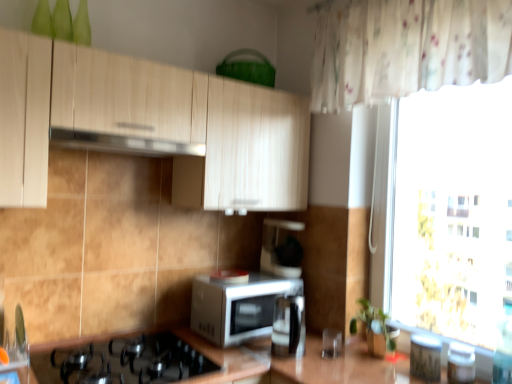
Question: Is white sheer curtain at right to the left of metallic silver toaster at lower right, which is the 2th appliance from right to left, from the viewer's perspective?

Choices:
 (A) yes
 (B) no

Answer: (B)

Question: Can you confirm if white sheer curtain at right is wider than metallic silver toaster at lower right, which is the 2th appliance from right to left?

Choices:
 (A) no
 (B) yes

Answer: (A)

Question: Is white sheer curtain at right further to the viewer compared to metallic silver toaster at lower right, which appears as the second appliance when viewed from the left?

Choices:
 (A) yes
 (B) no

Answer: (B)

Question: Considering the relative positions of white sheer curtain at right and metallic silver toaster at lower right, which appears as the second appliance when viewed from the left, in the image provided, is white sheer curtain at right to the right of metallic silver toaster at lower right, which appears as the second appliance when viewed from the left, from the viewer's perspective?

Choices:
 (A) no
 (B) yes

Answer: (B)

Question: Is white sheer curtain at right shorter than metallic silver toaster at lower right, which is the 2th appliance from right to left?

Choices:
 (A) yes
 (B) no

Answer: (B)

Question: From the image's perspective, is white sheer curtain at right under metallic silver toaster at lower right, which appears as the second appliance when viewed from the left?

Choices:
 (A) no
 (B) yes

Answer: (A)

Question: Considering the relative positions of light wood cabinet at upper center and metallic silver toaster at lower right, which appears as the second appliance when viewed from the left, in the image provided, is light wood cabinet at upper center to the right of metallic silver toaster at lower right, which appears as the second appliance when viewed from the left, from the viewer's perspective?

Choices:
 (A) yes
 (B) no

Answer: (B)

Question: Could you tell me if light wood cabinet at upper center is turned towards metallic silver toaster at lower right, which is the 2th appliance from right to left?

Choices:
 (A) no
 (B) yes

Answer: (A)

Question: Is there a large distance between light wood cabinet at upper center and metallic silver toaster at lower right, which is the 2th appliance from right to left?

Choices:
 (A) yes
 (B) no

Answer: (A)

Question: Is light wood cabinet at upper center smaller than metallic silver toaster at lower right, which is the 2th appliance from right to left?

Choices:
 (A) yes
 (B) no

Answer: (B)

Question: Considering the relative sizes of light wood cabinet at upper center and metallic silver toaster at lower right, which is the 2th appliance from right to left, in the image provided, is light wood cabinet at upper center taller than metallic silver toaster at lower right, which is the 2th appliance from right to left,?

Choices:
 (A) yes
 (B) no

Answer: (A)

Question: From a real-world perspective, is light wood cabinet at upper center positioned over metallic silver toaster at lower right, which appears as the second appliance when viewed from the left, based on gravity?

Choices:
 (A) yes
 (B) no

Answer: (A)

Question: Is white sheer curtain at right looking in the opposite direction of satin silver exhaust hood at upper center?

Choices:
 (A) no
 (B) yes

Answer: (A)